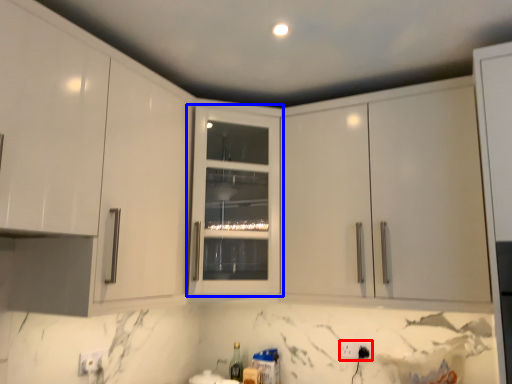
Question: Among these objects, which one is farthest to the camera, electric outlet (highlighted by a red box) or cabinetry (highlighted by a blue box)?

Choices:
 (A) electric outlet
 (B) cabinetry

Answer: (A)